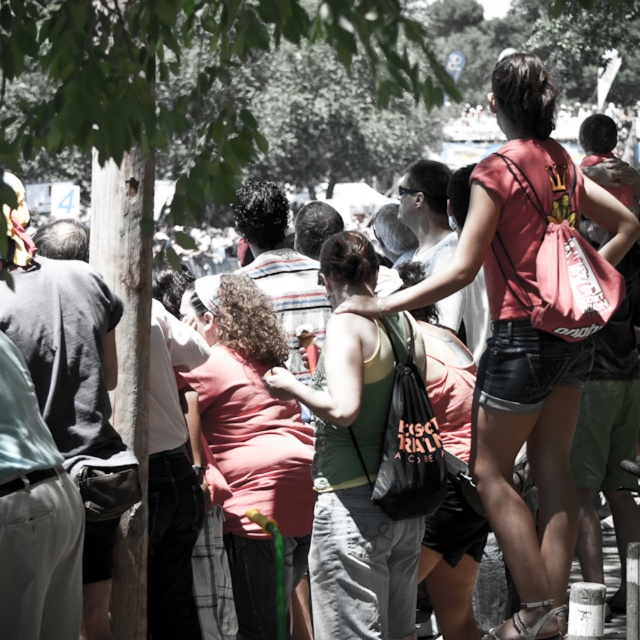
Question: Does green fabric tank top at center have a larger size compared to pink fabric shirt at center?

Choices:
 (A) yes
 (B) no

Answer: (B)

Question: Is green fabric tank top at center thinner than pink fabric shirt at center?

Choices:
 (A) no
 (B) yes

Answer: (A)

Question: Can you confirm if green fabric tank top at center is positioned below pink fabric shirt at center?

Choices:
 (A) yes
 (B) no

Answer: (B)

Question: Which point is closer to the camera taking this photo?

Choices:
 (A) (192, 298)
 (B) (380, 404)

Answer: (B)

Question: Which object is farther from the camera taking this photo?

Choices:
 (A) pink fabric shirt at center
 (B) green fabric tank top at center

Answer: (A)

Question: Which of the following is the closest to the observer?

Choices:
 (A) (336, 614)
 (B) (211, 428)

Answer: (A)